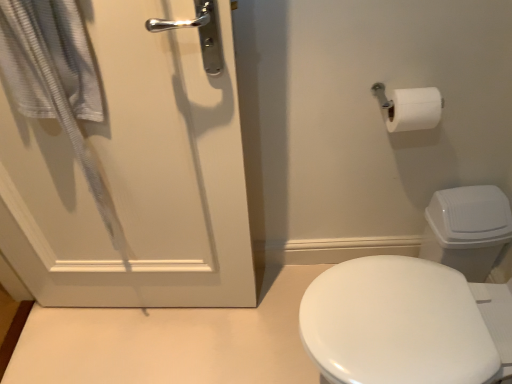
At what (x,y) coordinates should I click in order to perform the action: click on free location to the left of white matte door at left. Please return your answer as a coordinate pair (x, y). Image resolution: width=512 pixels, height=384 pixels. Looking at the image, I should click on (73, 338).